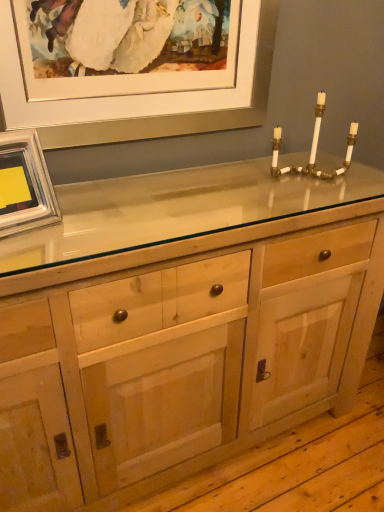
This screenshot has height=512, width=384. In order to click on free spot in front of white ceramic candle holder at upper right in this screenshot , I will do `click(316, 197)`.